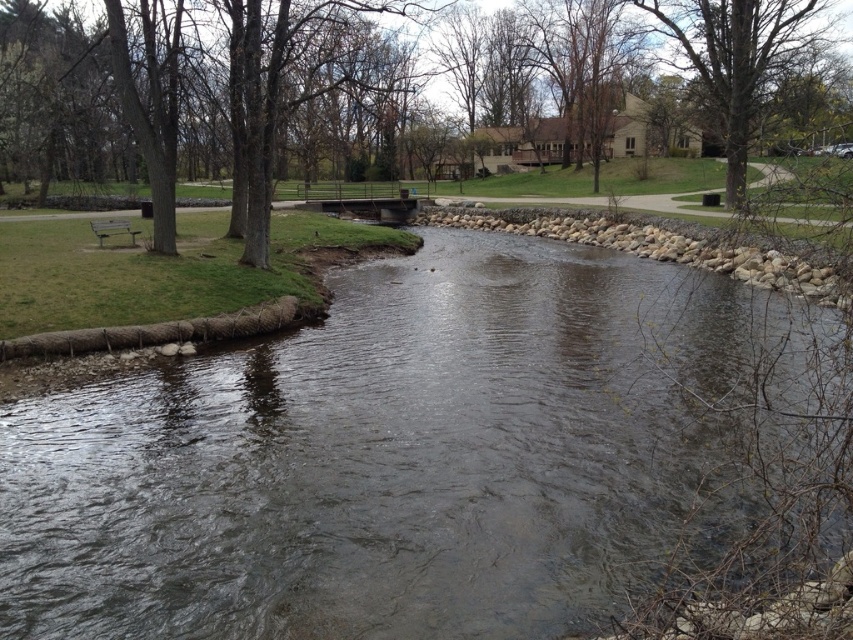
The image size is (853, 640). Describe the element at coordinates (82, 93) in the screenshot. I see `brown wood tree at upper center` at that location.

Can you confirm if brown wood tree at upper center is wider than metallic silver bench at left?

Indeed, brown wood tree at upper center has a greater width compared to metallic silver bench at left.

I want to click on brown wood tree at upper center, so point(82,93).

This screenshot has width=853, height=640. Find the location of `brown wood tree at upper center`. brown wood tree at upper center is located at coordinates (82, 93).

Is bare brown tree at upper center below metallic silver bench at left?

No.

Between point (782, 8) and point (126, 232), which one is positioned in front?

Positioned in front is point (126, 232).

Which is behind, point (749, 76) or point (120, 224)?

Point (749, 76)

Locate an element on the screen. The image size is (853, 640). bare brown tree at upper center is located at coordinates (735, 58).

Who is lower down, clear water at center or bare brown tree at upper center?

clear water at center is lower down.

Between clear water at center and bare brown tree at upper center, which one has less height?

With less height is clear water at center.

Who is more distant from viewer, (x=500, y=508) or (x=746, y=83)?

The point (x=746, y=83) is more distant.

Identify the location of clear water at center. (395, 458).